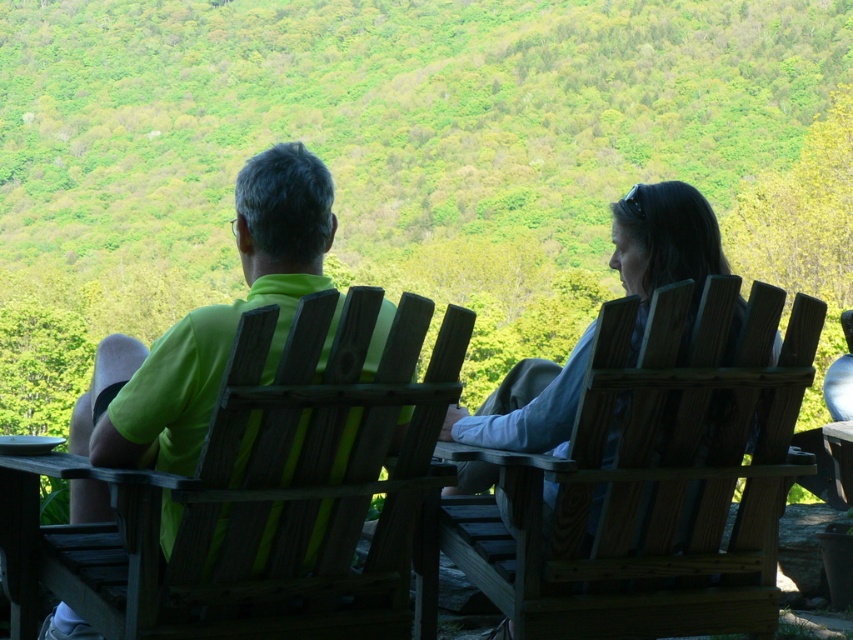
You are standing in front of the two chairs and want to sit down. Which chair, the wooden chair at left or the matte green shirt at center, is positioned to the right of the other?

The wooden chair at left is to the right of the matte green shirt at center.

You are planning to set up a small table between the wooden chair at right and the matte green shirt at center. Considering their sizes, which object should the table be placed closer to?

The table should be placed closer to the wooden chair at right because it occupies less space than the matte green shirt at center, allowing for better placement and balance.